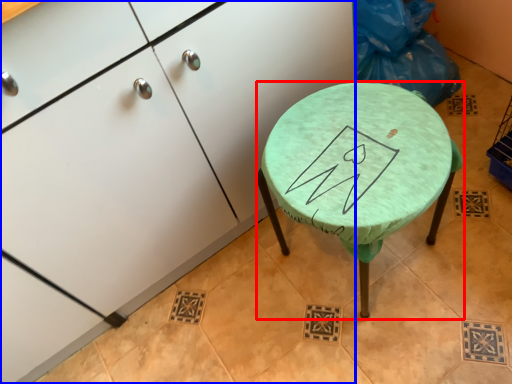
Question: Which point is closer to the camera, stool (highlighted by a red box) or cabinetry (highlighted by a blue box)?

Choices:
 (A) stool
 (B) cabinetry

Answer: (B)